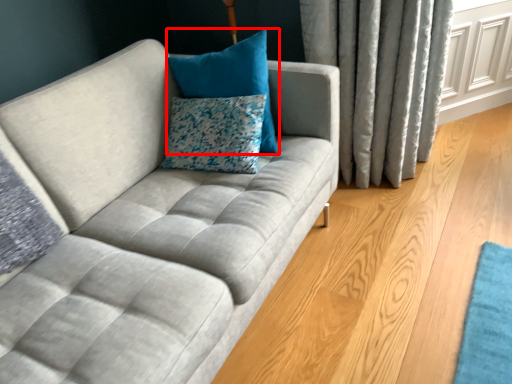
Question: From the image's perspective, considering the relative positions of pillow (annotated by the red box) and pillow in the image provided, where is pillow (annotated by the red box) located with respect to the staircase?

Choices:
 (A) below
 (B) above

Answer: (B)